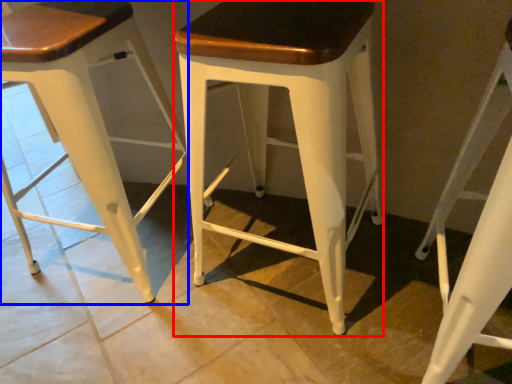
Question: Which point is further to the camera, stool (highlighted by a red box) or stool (highlighted by a blue box)?

Choices:
 (A) stool
 (B) stool

Answer: (B)